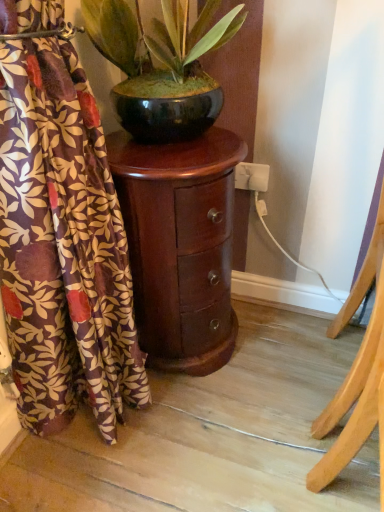
The width and height of the screenshot is (384, 512). What are the coordinates of `vacant area on top of shiny dark wood nightstand at center (from a real-world perspective)` in the screenshot? It's located at (178, 145).